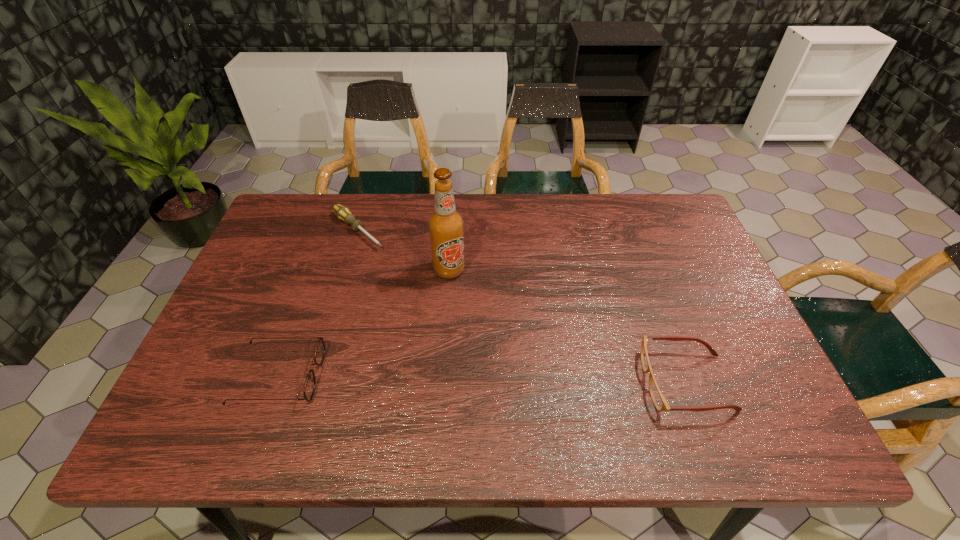
The image size is (960, 540). Identify the location of object that can be found as the closest to the rightmost object. (446, 225).

You are a GUI agent. You are given a task and a screenshot of the screen. Output one action in this format:
    pyautogui.click(x=<x>, y=<y>)
    Task: Click on the vacant space that satisfies the following two spatial constraints: 1. on the front side of the third nearest object; 2. on the front-facing side of the rightmost object
    The image size is (960, 540).
    Given the screenshot: What is the action you would take?
    pyautogui.click(x=442, y=382)